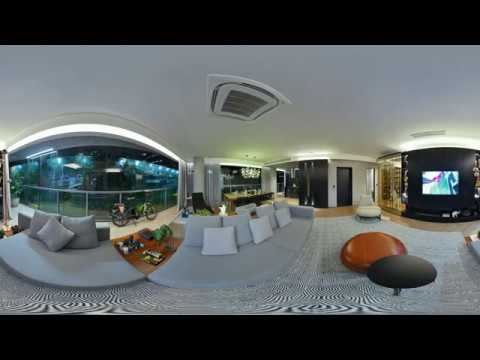
At what (x,y) coordinates should I click in order to perform the action: click on tv. Please return your answer as a coordinate pair (x, y). The image size is (480, 360). Looking at the image, I should click on (445, 185).